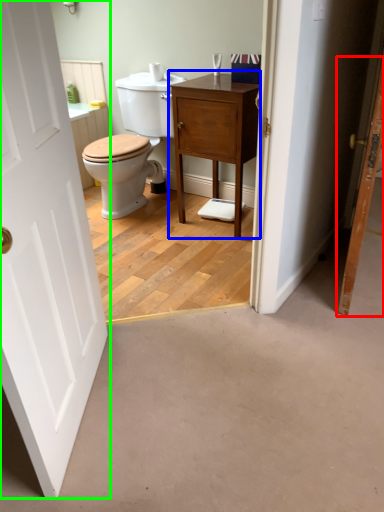
Question: Considering the real-world distances, which object is closest to door (highlighted by a red box)? nightstand (highlighted by a blue box) or door (highlighted by a green box).

Choices:
 (A) nightstand
 (B) door

Answer: (A)